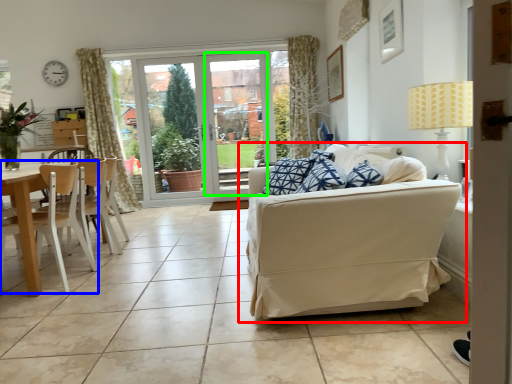
Question: Which object is positioned farthest from studio couch (highlighted by a red box)? Select from chair (highlighted by a blue box) and window screen (highlighted by a green box).

Choices:
 (A) chair
 (B) window screen

Answer: (B)